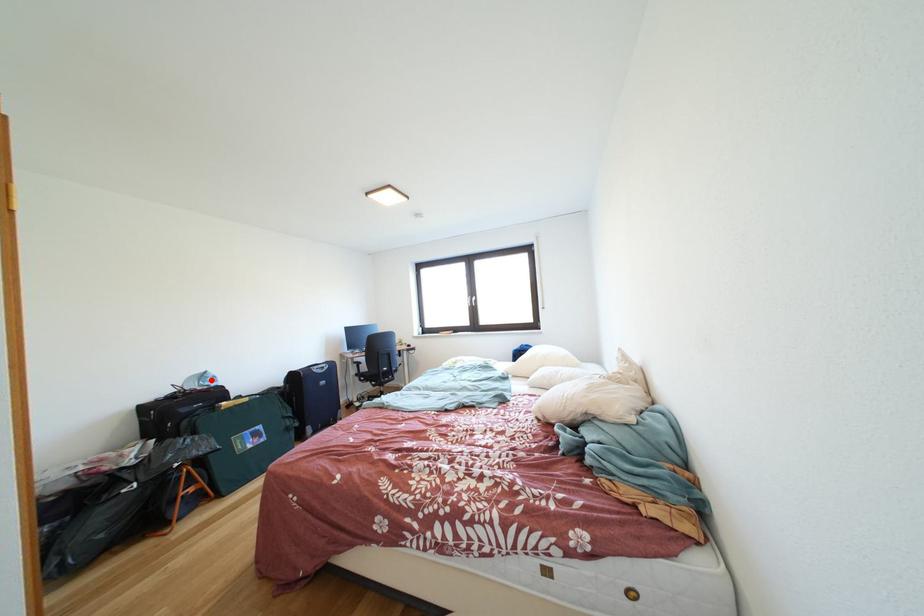
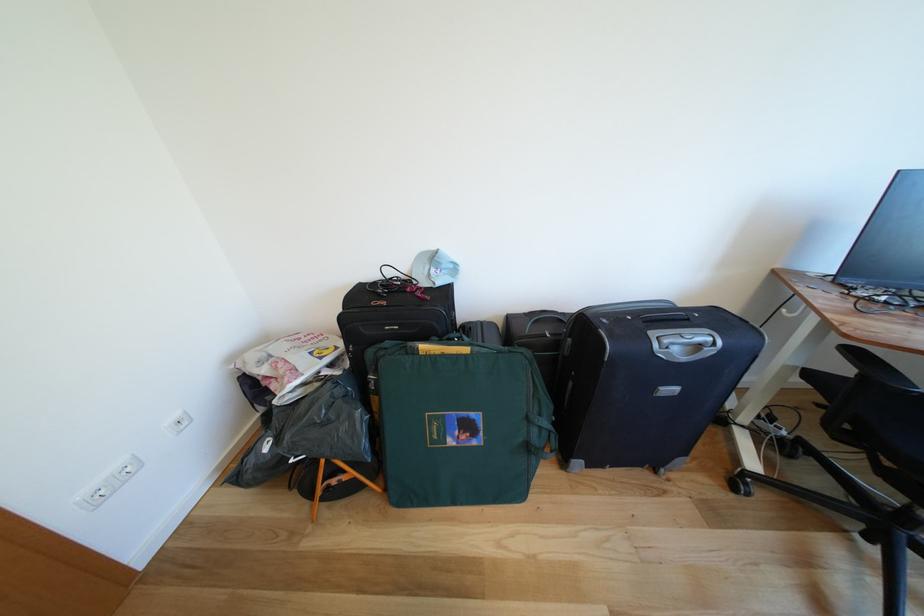
Where in the second image is the point corresponding to the highlighted location from the first image?

(442, 262)